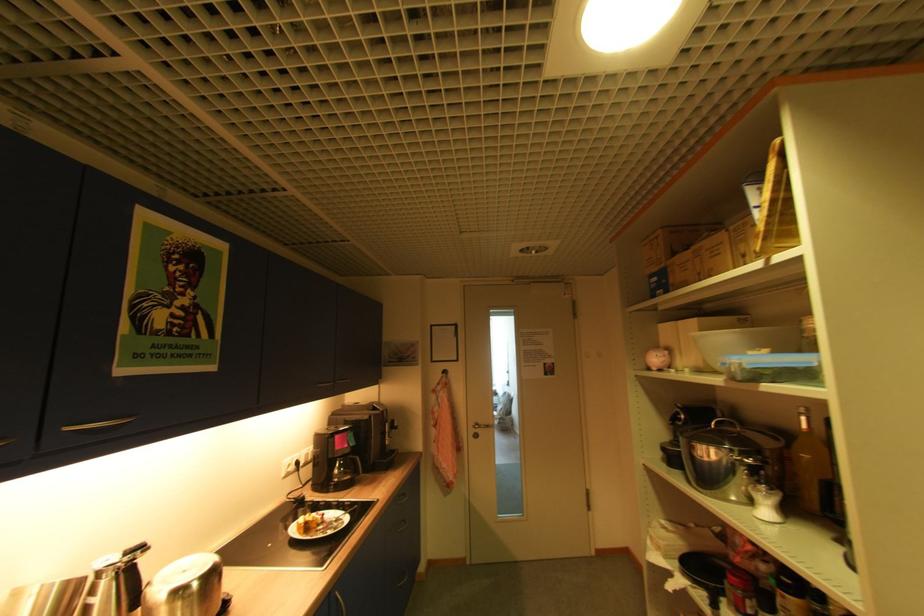
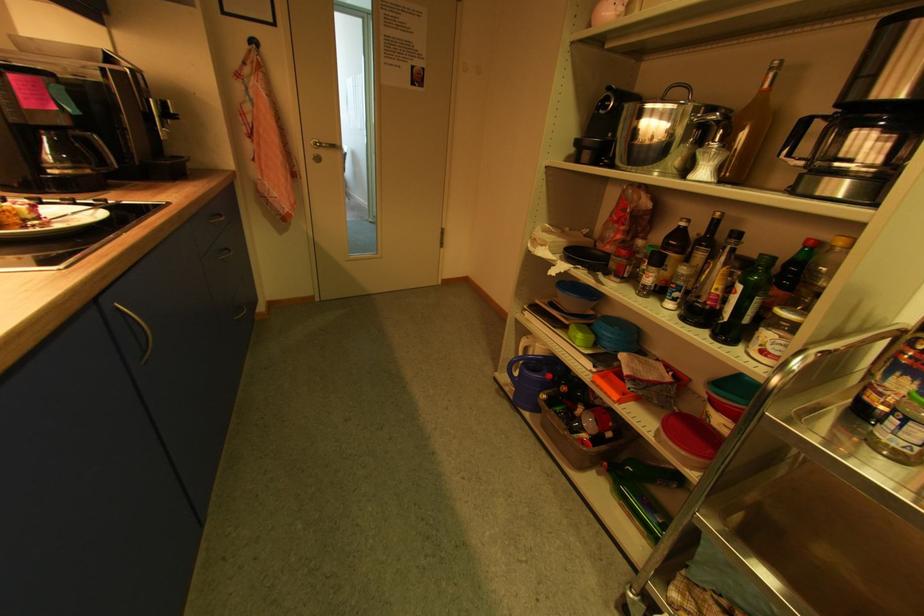
Locate, in the second image, the point that corresponds to the point at 772,513 in the first image.

(709, 175)